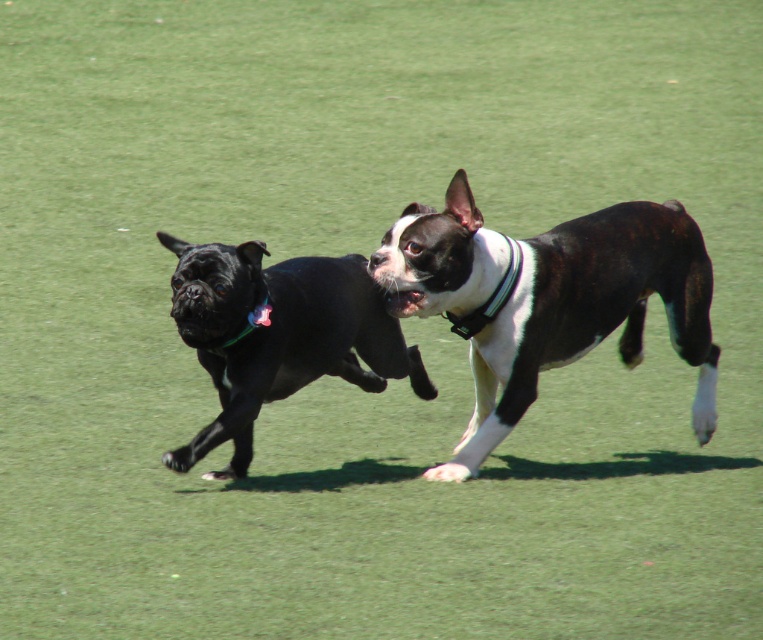
Question: Which of the following is the farthest from the observer?

Choices:
 (A) shiny black dog at left
 (B) black and white fur dog at center

Answer: (A)

Question: Which object is farther from the camera taking this photo?

Choices:
 (A) shiny black dog at left
 (B) black and white fur dog at center

Answer: (A)

Question: From the image, what is the correct spatial relationship of black and white fur dog at center in relation to shiny black dog at left?

Choices:
 (A) left
 (B) right

Answer: (B)

Question: Where is black and white fur dog at center located in relation to shiny black dog at left in the image?

Choices:
 (A) above
 (B) below

Answer: (A)

Question: Is black and white fur dog at center positioned at the back of shiny black dog at left?

Choices:
 (A) yes
 (B) no

Answer: (B)